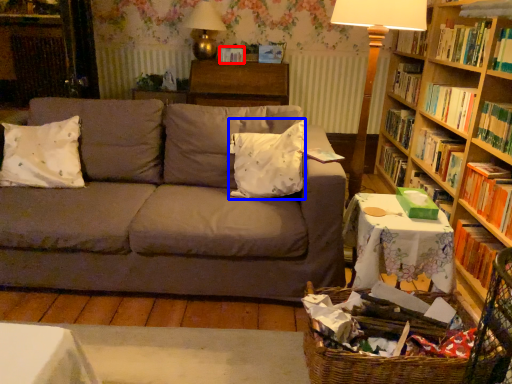
Question: Among these objects, which one is nearest to the camera, paperback book (highlighted by a red box) or pillow (highlighted by a blue box)?

Choices:
 (A) paperback book
 (B) pillow

Answer: (B)